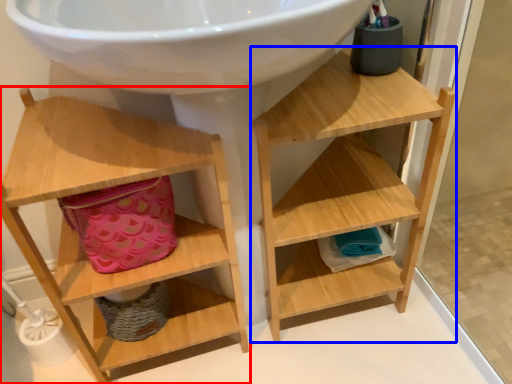
Question: Among these objects, which one is farthest to the camera, shelf (highlighted by a red box) or shelf (highlighted by a blue box)?

Choices:
 (A) shelf
 (B) shelf

Answer: (B)